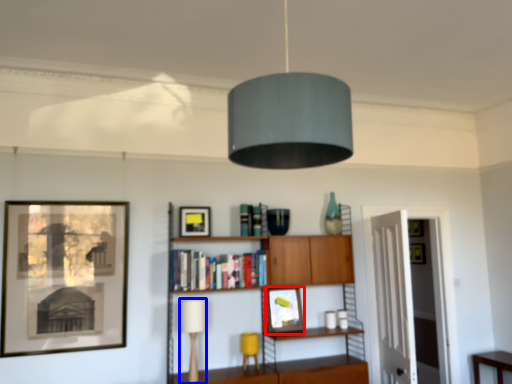
Question: Which point is further to the camera, picture frame (highlighted by a red box) or table lamp (highlighted by a blue box)?

Choices:
 (A) picture frame
 (B) table lamp

Answer: (A)